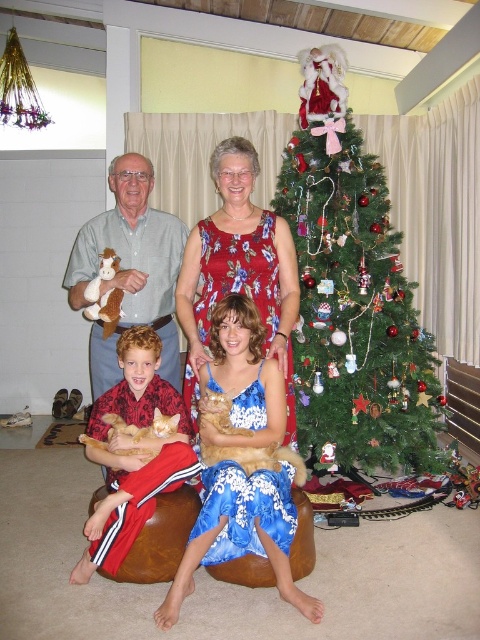
Which is more to the left, floral fabric dress at center or white plush cow at left?

white plush cow at left is more to the left.

Locate an element on the screen. The width and height of the screenshot is (480, 640). floral fabric dress at center is located at coordinates pos(239,273).

At what (x,y) coordinates should I click in order to perform the action: click on floral fabric dress at center. Please return your answer as a coordinate pair (x, y). Looking at the image, I should click on (239, 273).

Which is above, fluffy orange cat at center or orange fur cat at lower left?

orange fur cat at lower left

Between point (244, 435) and point (156, 429), which one is positioned behind?

The point (156, 429) is behind.

Find the location of a particular element. This screenshot has height=640, width=480. fluffy orange cat at center is located at coordinates (255, 458).

Who is positioned more to the left, blue floral dress at center or fluffy orange cat at center?

Positioned to the left is blue floral dress at center.

Is blue floral dress at center further to camera compared to fluffy orange cat at center?

No.

The height and width of the screenshot is (640, 480). Describe the element at coordinates (240, 532) in the screenshot. I see `blue floral dress at center` at that location.

The height and width of the screenshot is (640, 480). In order to click on blue floral dress at center in this screenshot , I will do `click(240, 532)`.